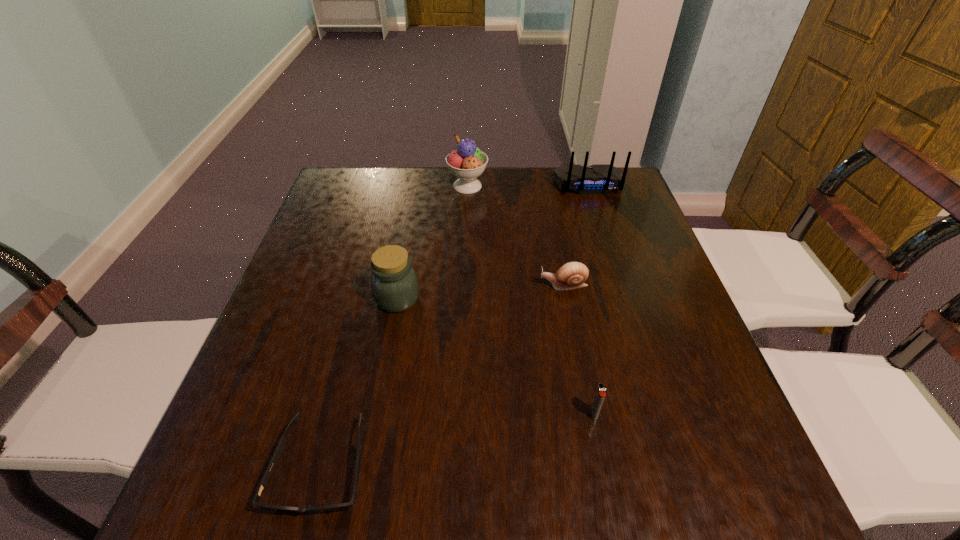
This screenshot has width=960, height=540. In order to click on object at the near left corner in this screenshot , I will do `click(279, 449)`.

Find the location of a particular element. The height and width of the screenshot is (540, 960). object at the far right corner is located at coordinates (597, 179).

Identify the location of free space at the far edge of the desktop. (442, 205).

In the image, there is a desktop. In order to click on vacant space at the near edge in this screenshot , I will do `click(385, 476)`.

Identify the location of vacant space at the left edge of the desktop. (236, 463).

In the image, there is a desktop. Identify the location of blank space at the right edge. (628, 284).

You are a GUI agent. You are given a task and a screenshot of the screen. Output one action in this format:
    pyautogui.click(x=<x>, y=<y>)
    Task: Click on the free region at the far right corner of the desktop
    The height and width of the screenshot is (540, 960).
    Given the screenshot: What is the action you would take?
    pyautogui.click(x=623, y=193)

Find the location of `free spot between the fifth tallest object and the second nearest object`. free spot between the fifth tallest object and the second nearest object is located at coordinates (579, 349).

At what (x,y) coordinates should I click in order to perform the action: click on free area in between the router and the igniter. Please return your answer as a coordinate pair (x, y). This screenshot has width=960, height=540. Looking at the image, I should click on (591, 299).

Find the location of a particular element. free spot between the jar and the second nearest object is located at coordinates (495, 356).